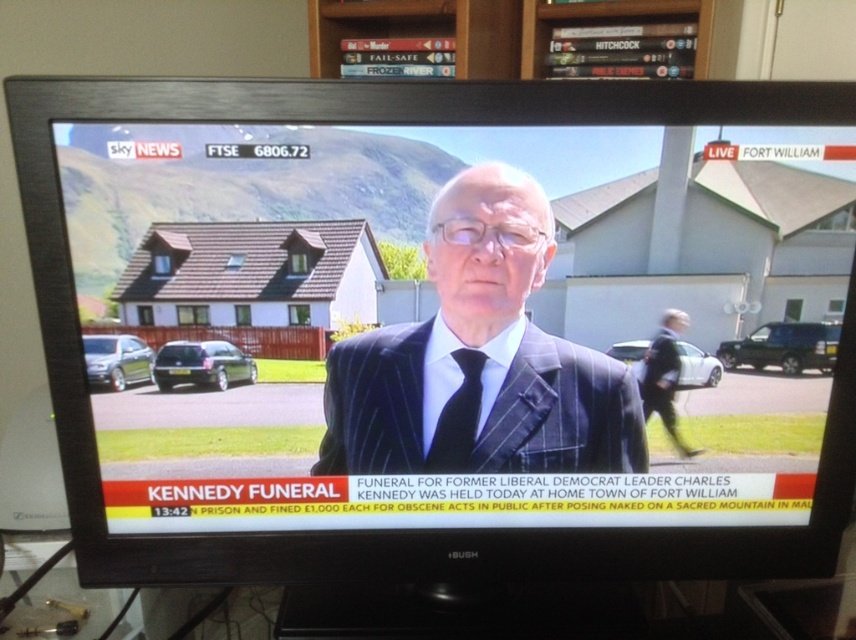
Question: Can you confirm if pinstriped suit at center is bigger than black silk tie at center?

Choices:
 (A) no
 (B) yes

Answer: (B)

Question: Which object is closer to the camera taking this photo?

Choices:
 (A) black silk tie at center
 (B) pinstriped suit at center

Answer: (B)

Question: Is pinstriped suit at center to the right of black silk tie at center from the viewer's perspective?

Choices:
 (A) yes
 (B) no

Answer: (A)

Question: Among these objects, which one is nearest to the camera?

Choices:
 (A) pinstriped suit at center
 (B) black silk tie at center

Answer: (A)

Question: Can you confirm if pinstriped suit at center is positioned below black silk tie at center?

Choices:
 (A) yes
 (B) no

Answer: (B)

Question: Which object appears closest to the camera in this image?

Choices:
 (A) pinstriped suit at center
 (B) black silk tie at center

Answer: (A)